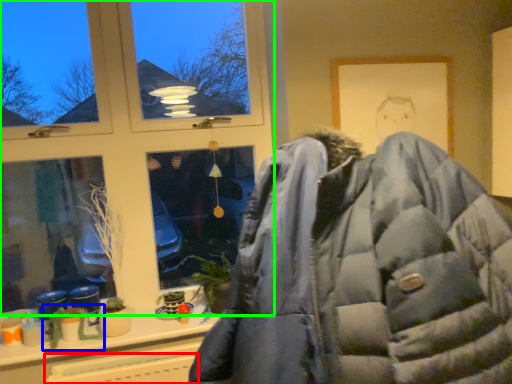
Question: Which is nearer to the radiator (highlighted by a red box)? plant (highlighted by a blue box) or window (highlighted by a green box).

Choices:
 (A) plant
 (B) window

Answer: (A)